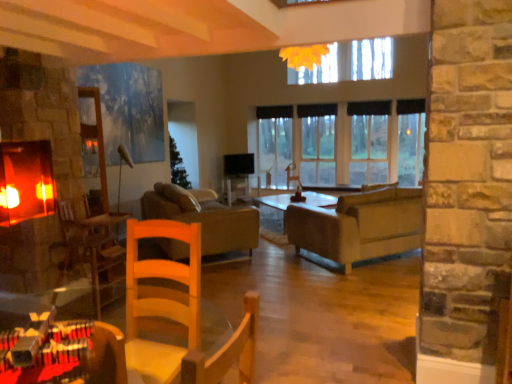
Question: Should I look upward or downward to see wooden armchair at left?

Choices:
 (A) up
 (B) down

Answer: (B)

Question: In which direction should I rotate to look at matte gray couch at center, which is counted as the first studio couch, starting from the right?

Choices:
 (A) right
 (B) left

Answer: (A)

Question: From the image's perspective, is wooden armchair at left under brown leather couch at center, the 1th studio couch in the left-to-right sequence?

Choices:
 (A) yes
 (B) no

Answer: (A)

Question: From a real-world perspective, is wooden armchair at left over brown leather couch at center, the second studio couch positioned from the right?

Choices:
 (A) no
 (B) yes

Answer: (B)

Question: From a real-world perspective, does wooden armchair at left sit lower than brown leather couch at center, the 1th studio couch in the left-to-right sequence?

Choices:
 (A) yes
 (B) no

Answer: (B)

Question: Can you confirm if wooden armchair at left is wider than brown leather couch at center, the second studio couch positioned from the right?

Choices:
 (A) no
 (B) yes

Answer: (A)

Question: From the image's perspective, does wooden armchair at left appear higher than brown leather couch at center, the 1th studio couch in the left-to-right sequence?

Choices:
 (A) yes
 (B) no

Answer: (B)

Question: Is wooden armchair at left positioned behind brown leather couch at center, the second studio couch positioned from the right?

Choices:
 (A) yes
 (B) no

Answer: (B)

Question: Is matte gray couch at center, the 2th studio couch positioned from the left, completely or partially outside of wooden table at lower left?

Choices:
 (A) no
 (B) yes

Answer: (B)

Question: Could wooden table at lower left be considered to be inside matte gray couch at center, which is counted as the first studio couch, starting from the right?

Choices:
 (A) no
 (B) yes

Answer: (A)

Question: From a real-world perspective, does matte gray couch at center, the 2th studio couch positioned from the left, sit lower than wooden table at lower left?

Choices:
 (A) yes
 (B) no

Answer: (A)

Question: Is matte gray couch at center, which is counted as the first studio couch, starting from the right, wider than wooden table at lower left?

Choices:
 (A) no
 (B) yes

Answer: (B)

Question: Is matte gray couch at center, the 2th studio couch positioned from the left, behind wooden table at lower left?

Choices:
 (A) no
 (B) yes

Answer: (B)

Question: From the image's perspective, is matte gray couch at center, the 2th studio couch positioned from the left, located above wooden table at lower left?

Choices:
 (A) no
 (B) yes

Answer: (B)

Question: Does wooden table at lower left turn towards wooden armchair at left?

Choices:
 (A) yes
 (B) no

Answer: (B)